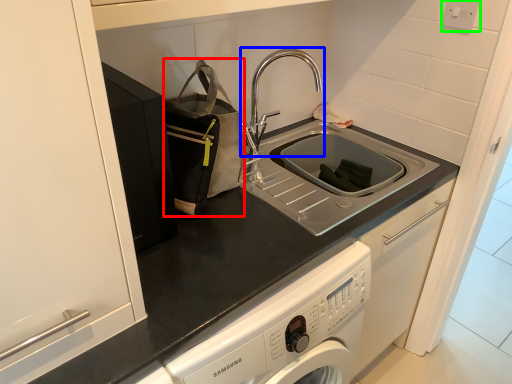
Question: Considering the real-world distances, which object is farthest from bag (highlighted by a red box)? tap (highlighted by a blue box) or electric outlet (highlighted by a green box)?

Choices:
 (A) tap
 (B) electric outlet

Answer: (B)